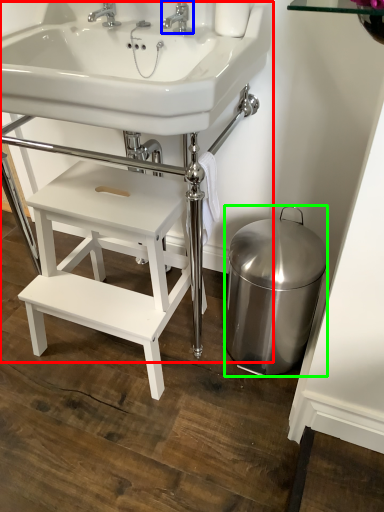
Question: Which object is positioned farthest from sink (highlighted by a red box)? Select from tap (highlighted by a blue box) and bidet (highlighted by a green box).

Choices:
 (A) tap
 (B) bidet

Answer: (B)